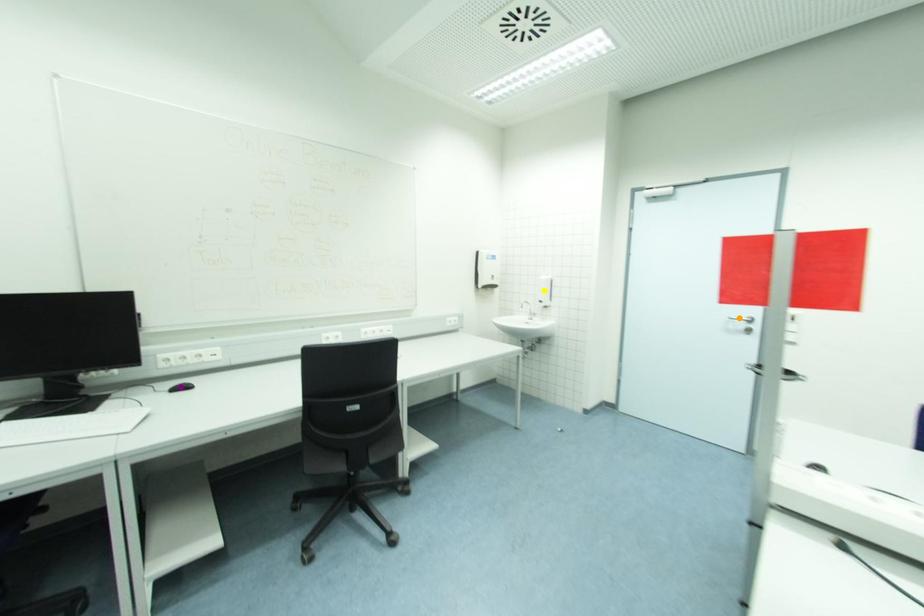
Order these from farthest to nearest:
yellow point | orange point | purple point

1. yellow point
2. orange point
3. purple point